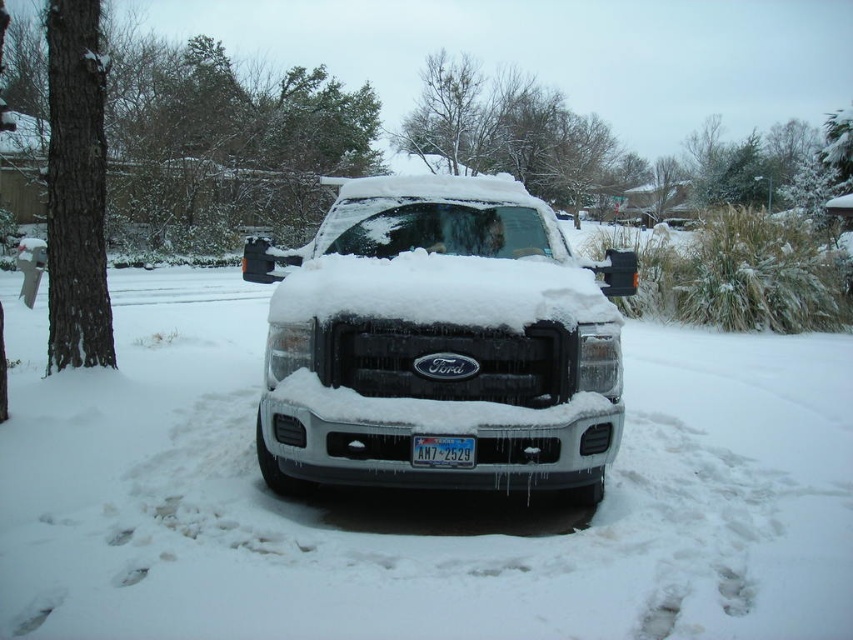
You are standing in front of the snowy driveway where the Ford pickup truck is parked. There are two points marked on the image at coordinates point (277, 310) and point (457, 442). Which point is closer to you?

Point (277, 310) is further to the camera than point (457, 442), so the closer point to you is point (457, 442).